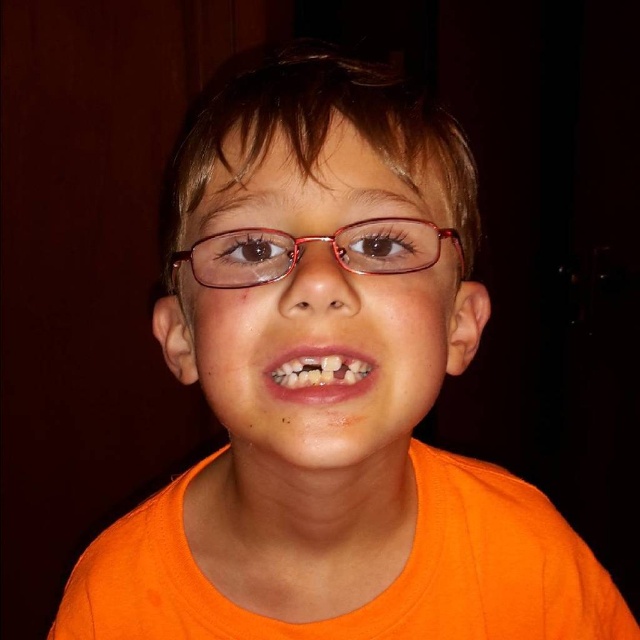
Which of these two, matte plastic glasses at center or white glossy teeth at center, stands shorter?

white glossy teeth at center

Between matte plastic glasses at center and white glossy teeth at center, which one appears on the left side from the viewer's perspective?

matte plastic glasses at center is more to the left.

Looking at this image, who is more forward, (419,342) or (316,380)?

Point (316,380) is more forward.

The height and width of the screenshot is (640, 640). I want to click on matte plastic glasses at center, so click(x=317, y=300).

Is point (404, 230) positioned before point (285, 369)?

No, (404, 230) is further to viewer.

Is point (248, 275) positioned after point (355, 355)?

Yes, it is behind point (355, 355).

Identify the location of matte pink plastic glasses at center. The width and height of the screenshot is (640, 640). (312, 241).

Which of these two, matte plastic glasses at center or matte pink plastic glasses at center, stands shorter?

matte pink plastic glasses at center is shorter.

Does matte plastic glasses at center have a greater width compared to matte pink plastic glasses at center?

Yes.

Which is in front, point (209, 364) or point (428, 240)?

Positioned in front is point (209, 364).

I want to click on matte plastic glasses at center, so click(317, 300).